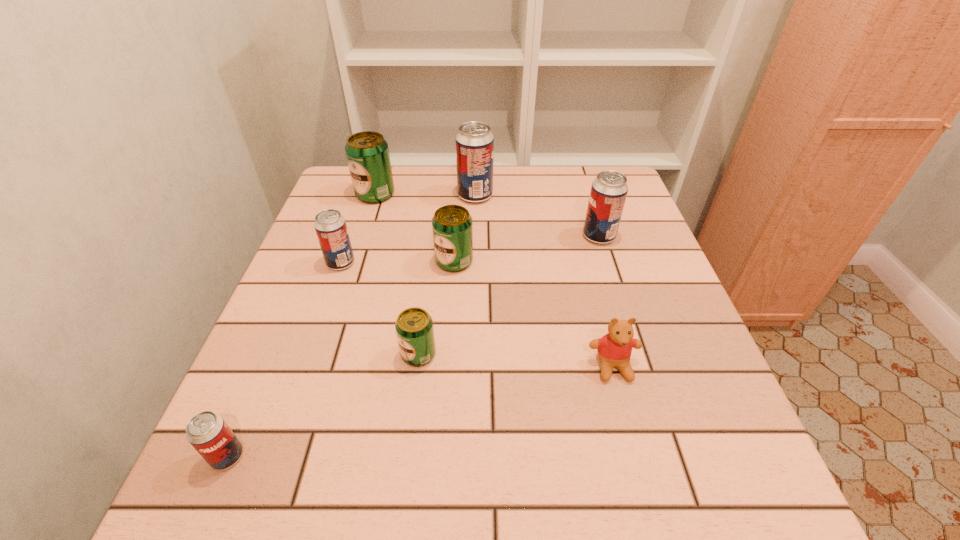
The image size is (960, 540). In order to click on the nearest green beer can in this screenshot , I will do `click(414, 326)`.

Locate an element on the screen. The width and height of the screenshot is (960, 540). the sixth farthest beer can is located at coordinates (414, 326).

At what (x,y) coordinates should I click in order to perform the action: click on the leftmost object. Please return your answer as a coordinate pair (x, y). This screenshot has height=540, width=960. Looking at the image, I should click on (207, 432).

Where is `the leftmost beer can`? The height and width of the screenshot is (540, 960). the leftmost beer can is located at coordinates (207, 432).

At what (x,y) coordinates should I click in order to perform the action: click on free location located 0.260m on the front of the biggest red beer can. Please return your answer as a coordinate pair (x, y). Looking at the image, I should click on (474, 270).

Locate an element on the screen. This screenshot has height=540, width=960. free space located 0.060m on the left of the leftmost green beer can is located at coordinates (334, 194).

You are a GUI agent. You are given a task and a screenshot of the screen. Output one action in this format:
    pyautogui.click(x=<x>, y=<y>)
    Task: Click on the free region located 0.310m on the back of the second biggest red beer can
    The height and width of the screenshot is (540, 960).
    Given the screenshot: What is the action you would take?
    pyautogui.click(x=576, y=166)

Where is `blank space located 0.190m on the right of the third red beer can from right to left`? The width and height of the screenshot is (960, 540). blank space located 0.190m on the right of the third red beer can from right to left is located at coordinates [437, 263].

The image size is (960, 540). Find the location of `vacant space located 0.180m on the left of the second biggest green beer can`. vacant space located 0.180m on the left of the second biggest green beer can is located at coordinates (358, 261).

Where is `blank space located 0.170m on the front-facing side of the red teddy bear`? The height and width of the screenshot is (540, 960). blank space located 0.170m on the front-facing side of the red teddy bear is located at coordinates (643, 482).